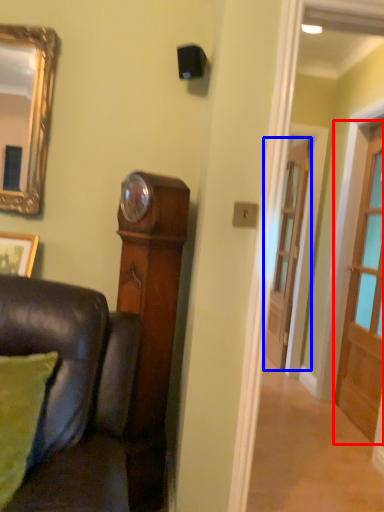
Question: Which object appears closest to the camera in this image, door (highlighted by a red box) or door (highlighted by a blue box)?

Choices:
 (A) door
 (B) door

Answer: (A)